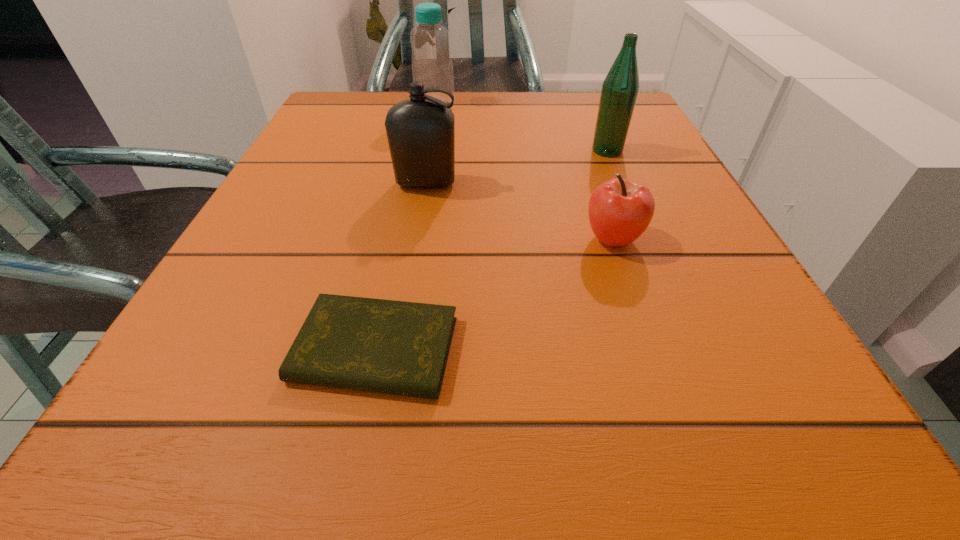
Choose which bottle is the nearest neighbor to the diary. Please provide its 2D coordinates. Your answer should be formatted as a tuple, i.e. [(x, y)], where the tuple contains the x and y coordinates of a point satisfying the conditions above.

[(421, 130)]

The height and width of the screenshot is (540, 960). In order to click on free space that satisfies the following two spatial constraints: 1. on the back side of the nearest object; 2. on the right side of the apple in this screenshot , I will do `click(398, 239)`.